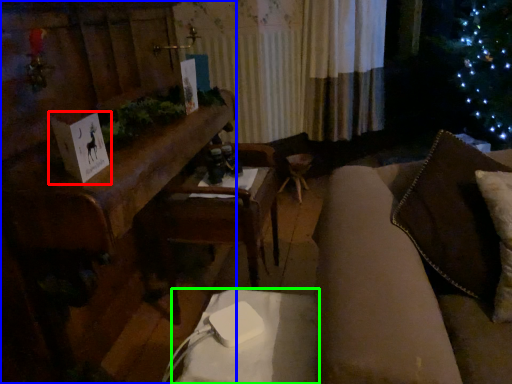
Question: Which is farther away from christmas card (highlighted by a red box)? furniture (highlighted by a blue box) or table (highlighted by a green box)?

Choices:
 (A) furniture
 (B) table

Answer: (B)